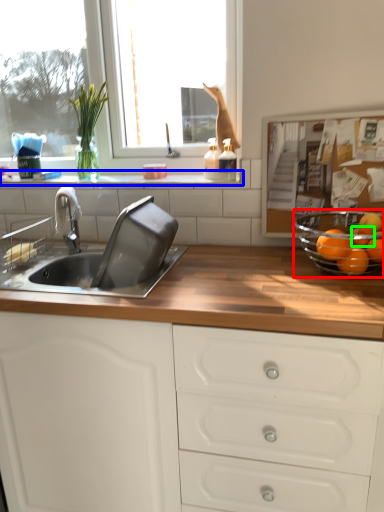
Question: Which object is positioned farthest from glass bowl (highlighted by a red box)? Select from window sill (highlighted by a blue box) and orange (highlighted by a green box).

Choices:
 (A) window sill
 (B) orange

Answer: (A)